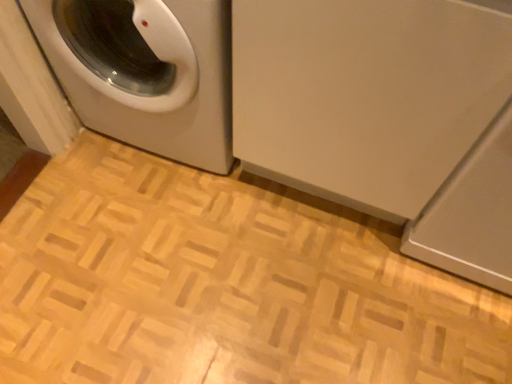
Question: Is white glossy washing machine at upper left, the second washing machine when ordered from left to right, in front of or behind white glossy washing machine at left, which is counted as the 1th washing machine, starting from the left, in the image?

Choices:
 (A) front
 (B) behind

Answer: (A)

Question: Does point (466, 23) appear closer or farther from the camera than point (202, 44)?

Choices:
 (A) farther
 (B) closer

Answer: (B)

Question: In terms of height, does white glossy washing machine at upper left, marked as the first washing machine in a right-to-left arrangement, look taller or shorter compared to white glossy washing machine at left, the 2th washing machine when ordered from right to left?

Choices:
 (A) tall
 (B) short

Answer: (A)

Question: Visually, is white glossy washing machine at left, which is counted as the 1th washing machine, starting from the left, positioned to the left or to the right of white glossy washing machine at upper left, the second washing machine when ordered from left to right?

Choices:
 (A) left
 (B) right

Answer: (A)

Question: In terms of width, does white glossy washing machine at left, the 2th washing machine when ordered from right to left, look wider or thinner when compared to white glossy washing machine at upper left, the second washing machine when ordered from left to right?

Choices:
 (A) thin
 (B) wide

Answer: (A)

Question: From the image's perspective, is white glossy washing machine at left, the 2th washing machine when ordered from right to left, above or below white glossy washing machine at upper left, the second washing machine when ordered from left to right?

Choices:
 (A) above
 (B) below

Answer: (A)

Question: Is white glossy washing machine at left, the 2th washing machine when ordered from right to left, situated inside white glossy washing machine at upper left, the second washing machine when ordered from left to right, or outside?

Choices:
 (A) inside
 (B) outside

Answer: (A)